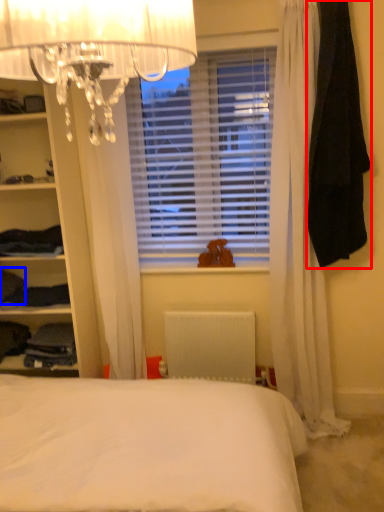
Question: Which object appears closest to the camera in this image, clothing (highlighted by a red box) or clothing (highlighted by a blue box)?

Choices:
 (A) clothing
 (B) clothing

Answer: (A)